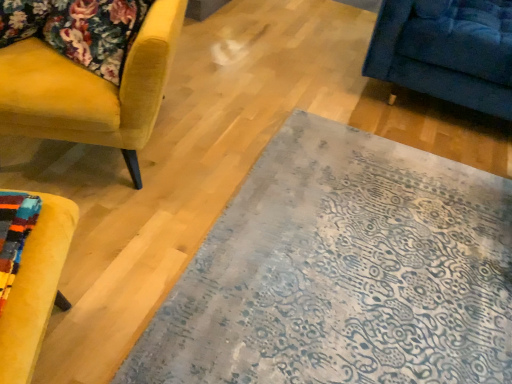
Where is `blue-patterned rug at center`? The height and width of the screenshot is (384, 512). blue-patterned rug at center is located at coordinates (343, 272).

Find the location of a particular element. The image size is (512, 384). velvet yellow armchair at left is located at coordinates (91, 90).

The image size is (512, 384). In order to click on chair on the left of velvet floral cushion at upper left in this screenshot , I will do `click(91, 90)`.

From the image's perspective, between velvet floral cushion at upper left and velvet yellow armchair at left, who is located below?

velvet yellow armchair at left is shown below in the image.

Is velvet floral cushion at upper left not near velvet yellow armchair at left?

No, velvet floral cushion at upper left is not far from velvet yellow armchair at left.

Does velvet floral cushion at upper left have a lesser height compared to velvet yellow armchair at left?

Indeed, velvet floral cushion at upper left has a lesser height compared to velvet yellow armchair at left.

Can you confirm if velvet floral cushion at upper left is shorter than blue-patterned rug at center?

No, velvet floral cushion at upper left is not shorter than blue-patterned rug at center.

Considering the positions of objects velvet floral cushion at upper left and blue-patterned rug at center in the image provided, who is more to the right, velvet floral cushion at upper left or blue-patterned rug at center?

blue-patterned rug at center is more to the right.

Is velvet floral cushion at upper left bigger or smaller than blue-patterned rug at center?

In the image, velvet floral cushion at upper left appears to be smaller than blue-patterned rug at center.

Between blue-patterned rug at center and velvet yellow armchair at left, which one is positioned behind?

Positioned behind is velvet yellow armchair at left.

Is point (301, 111) positioned behind point (16, 61)?

Yes.

From the image's perspective, is blue-patterned rug at center located above or below velvet yellow armchair at left?

Based on their image positions, blue-patterned rug at center is located beneath velvet yellow armchair at left.

From a real-world perspective, does velvet yellow armchair at left stand above velvet floral cushion at upper left?

Incorrect, from a real-world perspective, velvet yellow armchair at left is lower than velvet floral cushion at upper left.

From the image's perspective, is velvet yellow armchair at left above or below velvet floral cushion at upper left?

velvet yellow armchair at left is below velvet floral cushion at upper left.

In terms of width, does velvet yellow armchair at left look wider or thinner when compared to velvet floral cushion at upper left?

Clearly, velvet yellow armchair at left has more width compared to velvet floral cushion at upper left.

In the scene shown: Is velvet yellow armchair at left positioned with its back to velvet floral cushion at upper left?

No, velvet floral cushion at upper left is not at the back of velvet yellow armchair at left.

Considering the positions of points (84, 108) and (343, 307), is point (84, 108) closer to camera compared to point (343, 307)?

Yes, it is.

Can you tell me how much velvet yellow armchair at left and blue-patterned rug at center differ in facing direction?

111 degrees.

Which is more to the left, velvet yellow armchair at left or blue-patterned rug at center?

From the viewer's perspective, velvet yellow armchair at left appears more on the left side.

Is velvet yellow armchair at left beside blue-patterned rug at center?

There is a gap between velvet yellow armchair at left and blue-patterned rug at center.

Is blue-patterned rug at center far from velvet floral cushion at upper left?

No.

Does blue-patterned rug at center have a larger size compared to velvet floral cushion at upper left?

Indeed, blue-patterned rug at center has a larger size compared to velvet floral cushion at upper left.

From the image's perspective, does blue-patterned rug at center appear higher than velvet floral cushion at upper left?

No.

You are a GUI agent. You are given a task and a screenshot of the screen. Output one action in this format:
    pyautogui.click(x=<x>, y=<y>)
    Task: Click on the mat on the right of velvet floral cushion at upper left
    This screenshot has height=384, width=512.
    Given the screenshot: What is the action you would take?
    pyautogui.click(x=343, y=272)

This screenshot has height=384, width=512. In order to click on chair that appears below the velvet floral cushion at upper left (from a real-world perspective) in this screenshot , I will do `click(91, 90)`.

You are a GUI agent. You are given a task and a screenshot of the screen. Output one action in this format:
    pyautogui.click(x=<x>, y=<y>)
    Task: Click on the mat in front of the velvet floral cushion at upper left
    
    Given the screenshot: What is the action you would take?
    pyautogui.click(x=343, y=272)

Considering their positions, is velvet floral cushion at upper left positioned further to velvet yellow armchair at left than blue-patterned rug at center?

blue-patterned rug at center.

Looking at the image, which one is located closer to blue-patterned rug at center, velvet floral cushion at upper left or velvet yellow armchair at left?

velvet yellow armchair at left.

In the scene shown: Estimate the real-world distances between objects in this image. Which object is further from velvet yellow armchair at left, blue-patterned rug at center or velvet floral cushion at upper left?

blue-patterned rug at center.

Looking at the image, which one is located further to velvet floral cushion at upper left, blue-patterned rug at center or velvet yellow armchair at left?

blue-patterned rug at center lies further to velvet floral cushion at upper left than the other object.

Considering their positions, is velvet yellow armchair at left positioned closer to blue-patterned rug at center than velvet floral cushion at upper left?

velvet yellow armchair at left is positioned closer to the anchor blue-patterned rug at center.

Looking at this image, from the image, which object appears to be nearer to velvet floral cushion at upper left, velvet yellow armchair at left or blue-patterned rug at center?

velvet yellow armchair at left lies closer to velvet floral cushion at upper left than the other object.

Locate an element on the screen. This screenshot has height=384, width=512. fabric between velvet yellow armchair at left and blue-patterned rug at center in the horizontal direction is located at coordinates coord(78,29).